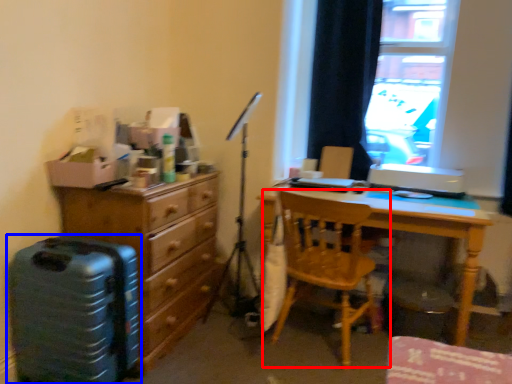
Question: Which of the following is the farthest to the observer, chair (highlighted by a red box) or luggage (highlighted by a blue box)?

Choices:
 (A) chair
 (B) luggage

Answer: (A)